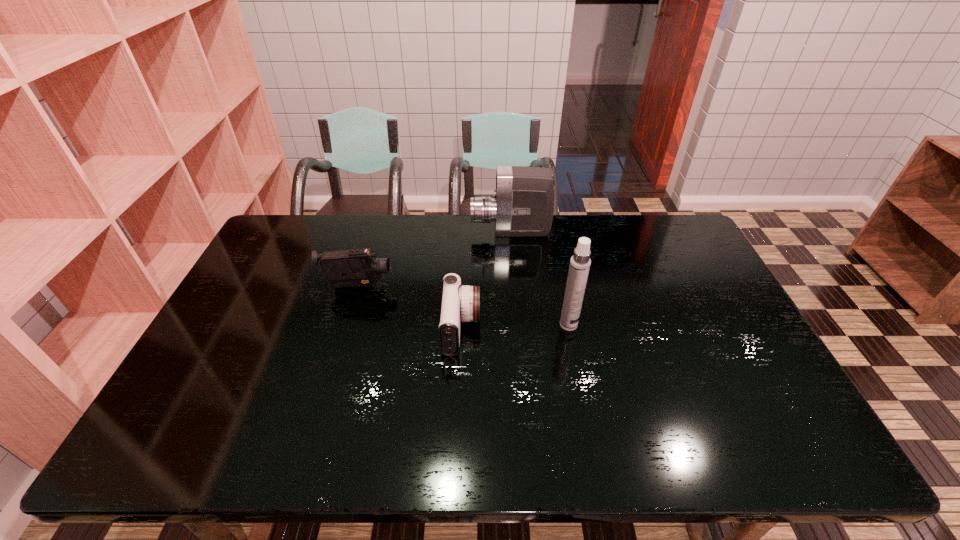
I want to click on empty space between the leftmost camcorder and the farthest object, so click(434, 259).

I want to click on vacant point located between the second tallest object and the nearest camcorder, so click(x=486, y=280).

Identify the location of empty space that is in between the nearest camcorder and the tallest object. (515, 327).

Where is `vacant space in between the nearest camcorder and the tallest camcorder`? vacant space in between the nearest camcorder and the tallest camcorder is located at coordinates (486, 280).

Where is `free space between the farthest camcorder and the tallest object`? The height and width of the screenshot is (540, 960). free space between the farthest camcorder and the tallest object is located at coordinates (540, 278).

This screenshot has height=540, width=960. In order to click on free space between the farthest camcorder and the nearest camcorder in this screenshot , I will do `click(486, 280)`.

Where is `free space between the aerosol can and the nearest camcorder`? The width and height of the screenshot is (960, 540). free space between the aerosol can and the nearest camcorder is located at coordinates (515, 327).

The image size is (960, 540). Find the location of `object that is the third closest to the leftmost camcorder`. object that is the third closest to the leftmost camcorder is located at coordinates (580, 262).

Identify the location of object that is the closest to the farthest camcorder. (459, 303).

Where is `camcorder identified as the second closest to the farthest object`? camcorder identified as the second closest to the farthest object is located at coordinates (357, 267).